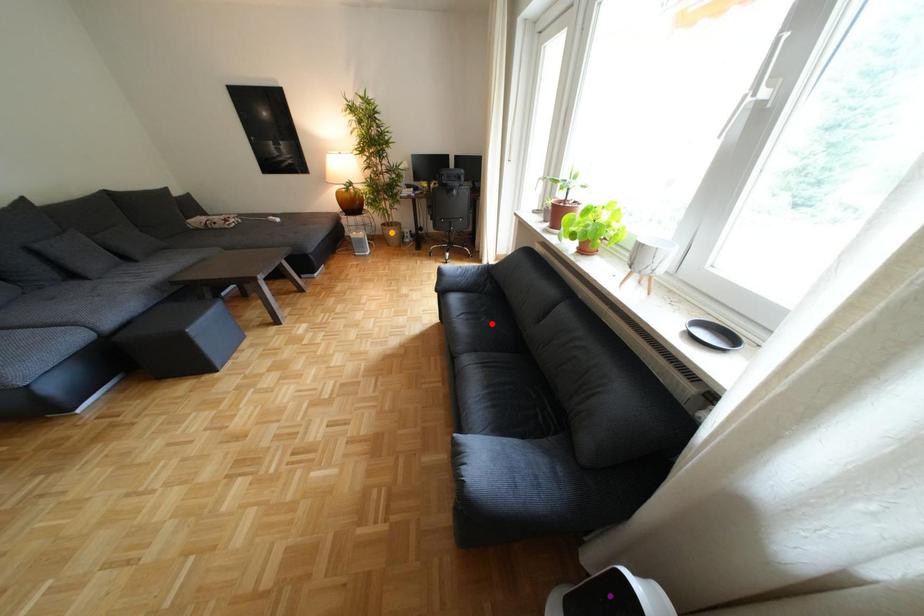
Order these from nearest to farthest:
1. red point
2. orange point
3. purple point

1. purple point
2. red point
3. orange point